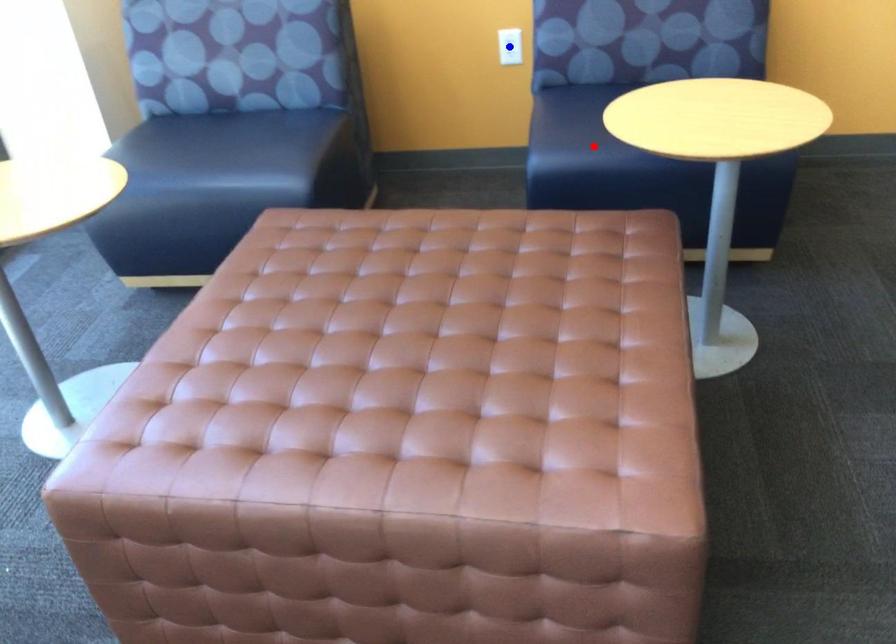
Question: Two points are marked on the image. Which point is closer to the camera?

Choices:
 (A) Blue point is closer.
 (B) Red point is closer.

Answer: (B)